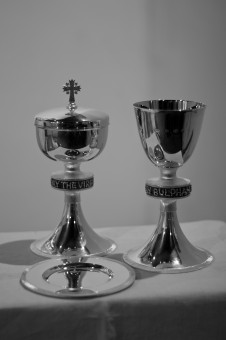
You are a GUI agent. You are given a task and a screenshot of the screen. Output one action in this format:
    pyautogui.click(x=<x>, y=<y>)
    Task: Click on the wall
    The height and width of the screenshot is (340, 226).
    Given the screenshot: What is the action you would take?
    pyautogui.click(x=114, y=203)